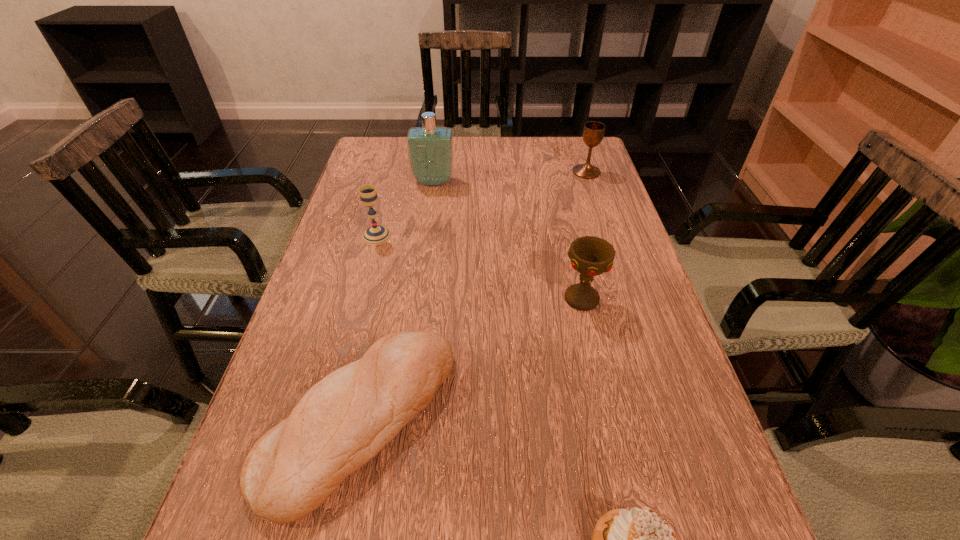
The image size is (960, 540). In order to click on free space at the far left corner of the desktop in this screenshot , I will do `click(375, 145)`.

Locate an element on the screen. The width and height of the screenshot is (960, 540). free space at the far right corner of the desktop is located at coordinates (593, 158).

Where is `vacant space that is in between the perfume and the second nearest chalice`? vacant space that is in between the perfume and the second nearest chalice is located at coordinates (405, 209).

You are a GUI agent. You are given a task and a screenshot of the screen. Output one action in this format:
    pyautogui.click(x=<x>, y=<y>)
    Task: Click on the vacant region between the rightmost object and the tallest object
    The image size is (960, 540).
    Given the screenshot: What is the action you would take?
    pyautogui.click(x=510, y=177)

Where is `free space between the third nearest object and the farthest chalice`? free space between the third nearest object and the farthest chalice is located at coordinates (585, 235).

At what (x,y) coordinates should I click in order to perform the action: click on vacant point located between the perfume and the second farthest chalice. Please return your answer as a coordinate pair (x, y). This screenshot has width=960, height=540. Looking at the image, I should click on (405, 209).

Locate an element on the screen. free space that is in between the farthest chalice and the bread is located at coordinates (473, 295).

In order to click on free space between the bread and the rightmost object in this screenshot , I will do `click(473, 295)`.

Find the location of a particular element. object that stands as the fifth closest to the pastry is located at coordinates coord(593,132).

In order to click on object that is the fourth closest one to the bread in this screenshot , I will do `click(430, 149)`.